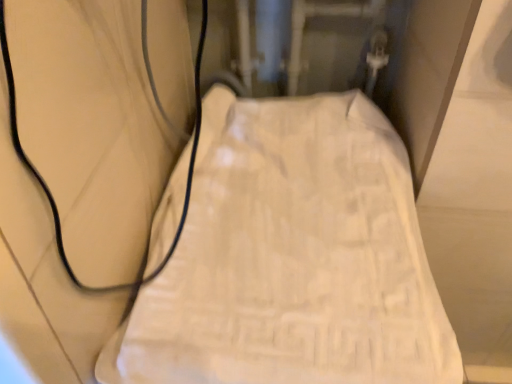
This screenshot has height=384, width=512. Describe the element at coordinates (292, 258) in the screenshot. I see `white textured towel at center` at that location.

Image resolution: width=512 pixels, height=384 pixels. What are the coordinates of `white textured towel at center` in the screenshot? It's located at (292, 258).

Describe the element at coordinates (47, 186) in the screenshot. I see `black rubber wire at left` at that location.

The width and height of the screenshot is (512, 384). In order to click on black rubber wire at left in this screenshot , I will do 47,186.

Image resolution: width=512 pixels, height=384 pixels. I want to click on white textured towel at center, so click(x=292, y=258).

Based on their positions, is white textured towel at center located to the left or right of black rubber wire at left?

In the image, white textured towel at center appears on the right side of black rubber wire at left.

In the image, is white textured towel at center positioned in front of or behind black rubber wire at left?

In the image, white textured towel at center appears behind black rubber wire at left.

Is point (432, 313) closer or farther from the camera than point (10, 105)?

Point (432, 313) is farther from the camera than point (10, 105).

From the picture: From the image's perspective, is white textured towel at center on top of black rubber wire at left?

No.

From a real-world perspective, between white textured towel at center and black rubber wire at left, who is vertically higher?

From a 3D spatial view, black rubber wire at left is above.

Considering the sizes of objects white textured towel at center and black rubber wire at left in the image provided, who is wider, white textured towel at center or black rubber wire at left?

white textured towel at center.

Who is taller, white textured towel at center or black rubber wire at left?

With more height is white textured towel at center.

Who is bigger, white textured towel at center or black rubber wire at left?

Bigger between the two is white textured towel at center.

Is white textured towel at center situated inside black rubber wire at left or outside?

white textured towel at center is not enclosed by black rubber wire at left.

Is white textured towel at center next to black rubber wire at left?

There is a gap between white textured towel at center and black rubber wire at left.

Is white textured towel at center facing towards black rubber wire at left?

No, white textured towel at center is not turned towards black rubber wire at left.

What's the angular difference between white textured towel at center and black rubber wire at left's facing directions?

0.305 degrees separate the facing orientations of white textured towel at center and black rubber wire at left.

Locate an element on the screen. The image size is (512, 384). wire that appears in front of the white textured towel at center is located at coordinates (47, 186).

Does black rubber wire at left appear on the right side of white textured towel at center?

No, black rubber wire at left is not to the right of white textured towel at center.

Is the position of black rubber wire at left more distant than that of white textured towel at center?

No, it is in front of white textured towel at center.

Is point (200, 112) positioned after point (192, 227)?

Yes, point (200, 112) is behind point (192, 227).

From the image's perspective, which is below, black rubber wire at left or white textured towel at center?

From the image's view, white textured towel at center is below.

In the scene shown: From a real-world perspective, is black rubber wire at left physically located above or below white textured towel at center?

black rubber wire at left is above white textured towel at center.

Can you confirm if black rubber wire at left is wider than white textured towel at center?

No, black rubber wire at left is not wider than white textured towel at center.

Considering the relative sizes of black rubber wire at left and white textured towel at center in the image provided, is black rubber wire at left taller than white textured towel at center?

No, black rubber wire at left is not taller than white textured towel at center.

Can you confirm if black rubber wire at left is bigger than white textured towel at center?

Result: Incorrect, black rubber wire at left is not larger than white textured towel at center.

Is black rubber wire at left surrounding white textured towel at center?

No, white textured towel at center is not surrounded by black rubber wire at left.

Is black rubber wire at left touching white textured towel at center?

black rubber wire at left and white textured towel at center are not in contact.

Could you tell me if black rubber wire at left is turned towards white textured towel at center?

No, black rubber wire at left is not turned towards white textured towel at center.

How different are the orientations of black rubber wire at left and white textured towel at center in degrees?

0.305 degrees separate the facing orientations of black rubber wire at left and white textured towel at center.

Looking at this image, measure the distance from black rubber wire at left to white textured towel at center.

The distance of black rubber wire at left from white textured towel at center is 8.01 inches.

Find the location of a particular element. The image size is (512, 384). wire that appears on the left of white textured towel at center is located at coordinates (47, 186).

Locate an element on the screen. The image size is (512, 384). furniture that is on the right side of black rubber wire at left is located at coordinates (292, 258).

What are the coordinates of `wire lying above the white textured towel at center (from the image's perspective)` in the screenshot? It's located at (47, 186).